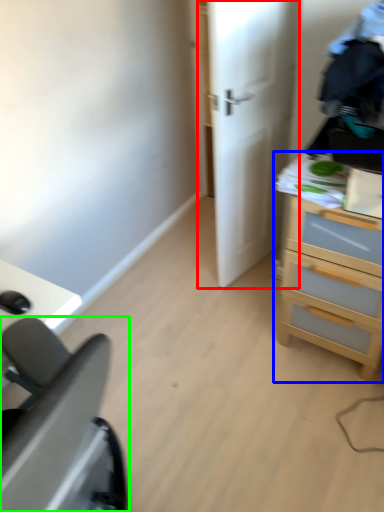
Question: Based on their relative distances, which object is farther from door (highlighted by a red box)? Choose from chest of drawers (highlighted by a blue box) and furniture (highlighted by a green box).

Choices:
 (A) chest of drawers
 (B) furniture

Answer: (B)